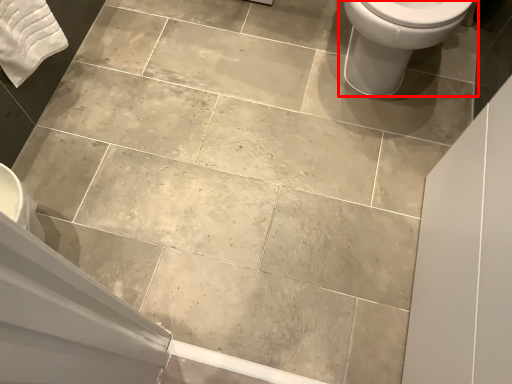
Question: From the image's perspective, considering the relative positions of toilet (annotated by the red box) and bath towel in the image provided, where is toilet (annotated by the red box) located with respect to the staircase?

Choices:
 (A) below
 (B) above

Answer: (B)